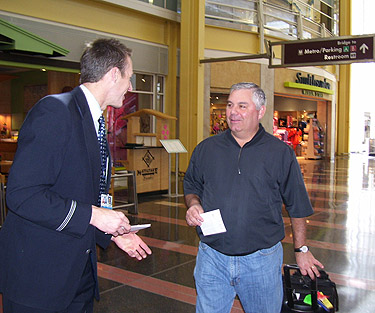
Locate an element on the screen. The image size is (375, 313). floor is located at coordinates 172,230, 335,187.